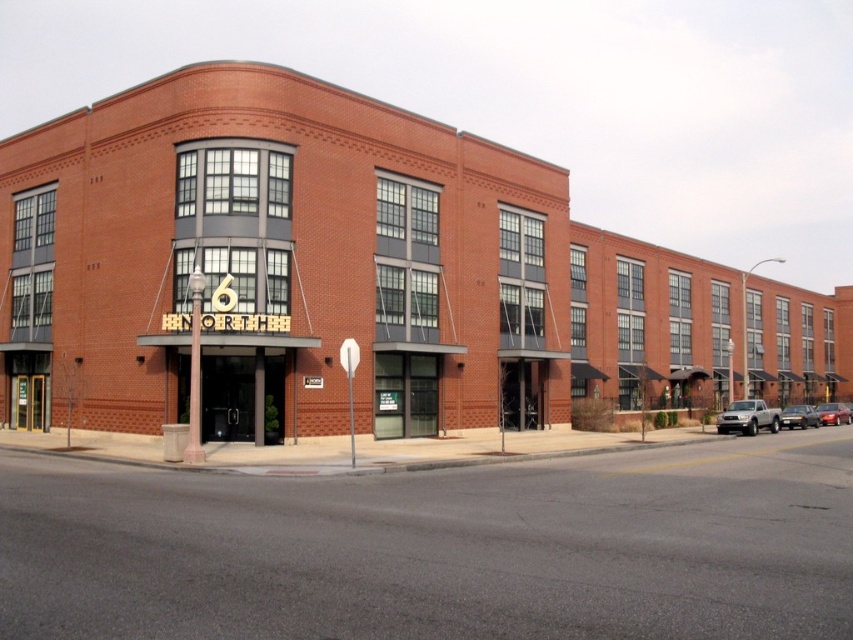
Does point (749, 417) lie in front of point (848, 412)?

Yes, it is in front of point (848, 412).

What do you see at coordinates (747, 417) in the screenshot? I see `satin silver truck at lower right` at bounding box center [747, 417].

Identify the location of satin silver truck at lower right. (747, 417).

Consider the image. Can you confirm if metallic silver sedan at center is bigger than shiny silver sedan at center?

Incorrect, metallic silver sedan at center is not larger than shiny silver sedan at center.

Does metallic silver sedan at center appear under shiny silver sedan at center?

Actually, metallic silver sedan at center is above shiny silver sedan at center.

Is point (785, 412) more distant than point (819, 404)?

No, it is not.

Find the location of `metallic silver sedan at center`. metallic silver sedan at center is located at coordinates pyautogui.click(x=799, y=417).

Can you confirm if satin silver truck at lower right is smaller than metallic silver sedan at center?

Indeed, satin silver truck at lower right has a smaller size compared to metallic silver sedan at center.

Based on the photo, measure the distance between satin silver truck at lower right and metallic silver sedan at center.

satin silver truck at lower right is 4.20 meters away from metallic silver sedan at center.

Is point (740, 404) positioned after point (790, 410)?

No, it is not.

This screenshot has width=853, height=640. What are the coordinates of `satin silver truck at lower right` in the screenshot? It's located at (747, 417).